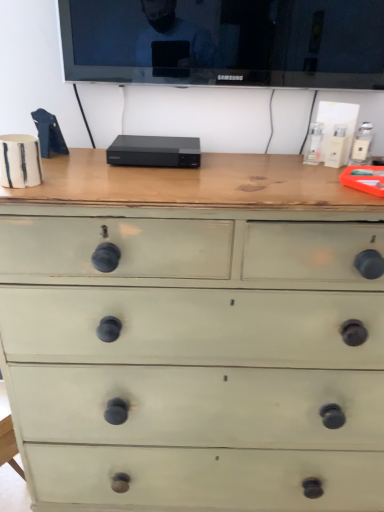
Question: Should I look upward or downward to see green painted wood chest of drawers at center?

Choices:
 (A) down
 (B) up

Answer: (A)

Question: Is green painted wood chest of drawers at center surrounding black glossy tv at upper center?

Choices:
 (A) no
 (B) yes

Answer: (A)

Question: Is green painted wood chest of drawers at center turned away from black glossy tv at upper center?

Choices:
 (A) yes
 (B) no

Answer: (B)

Question: From the image's perspective, is green painted wood chest of drawers at center above black glossy tv at upper center?

Choices:
 (A) no
 (B) yes

Answer: (A)

Question: Can you confirm if green painted wood chest of drawers at center is wider than black glossy tv at upper center?

Choices:
 (A) yes
 (B) no

Answer: (A)

Question: Could you tell me if green painted wood chest of drawers at center is turned towards black glossy tv at upper center?

Choices:
 (A) no
 (B) yes

Answer: (A)

Question: From the image's perspective, is green painted wood chest of drawers at center located beneath black glossy tv at upper center?

Choices:
 (A) no
 (B) yes

Answer: (B)

Question: Is black glossy tv at upper center closer to camera compared to green painted wood chest of drawers at center?

Choices:
 (A) no
 (B) yes

Answer: (A)

Question: Is black glossy tv at upper center at the right side of green painted wood chest of drawers at center?

Choices:
 (A) no
 (B) yes

Answer: (B)

Question: Are black glossy tv at upper center and green painted wood chest of drawers at center far apart?

Choices:
 (A) no
 (B) yes

Answer: (A)

Question: Considering the relative sizes of black glossy tv at upper center and green painted wood chest of drawers at center in the image provided, is black glossy tv at upper center thinner than green painted wood chest of drawers at center?

Choices:
 (A) no
 (B) yes

Answer: (B)

Question: Considering the relative sizes of black glossy tv at upper center and green painted wood chest of drawers at center in the image provided, is black glossy tv at upper center bigger than green painted wood chest of drawers at center?

Choices:
 (A) no
 (B) yes

Answer: (A)

Question: Can we say black glossy tv at upper center lies outside green painted wood chest of drawers at center?

Choices:
 (A) no
 (B) yes

Answer: (B)

Question: From the image's perspective, is green painted wood chest of drawers at center above or below black glossy tv at upper center?

Choices:
 (A) above
 (B) below

Answer: (B)